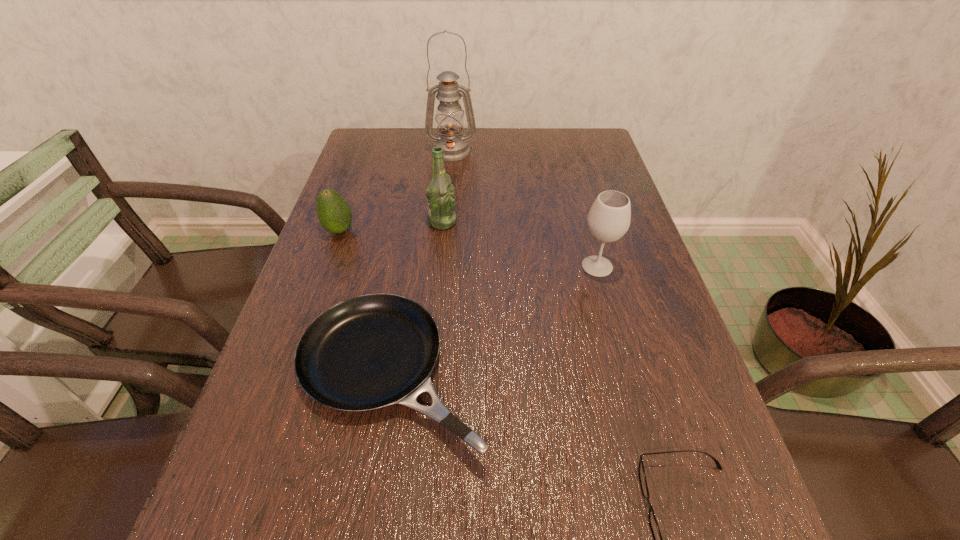
Where is `blank space located on the back of the second shortest object`? blank space located on the back of the second shortest object is located at coordinates (417, 224).

What are the coordinates of `object that is at the far edge` in the screenshot? It's located at (449, 117).

Locate an element on the screen. avocado that is at the left edge is located at coordinates (334, 214).

You are a GUI agent. You are given a task and a screenshot of the screen. Output one action in this format:
    pyautogui.click(x=<x>, y=<y>)
    Task: Click on the pan at the left edge
    The height and width of the screenshot is (540, 960).
    Given the screenshot: What is the action you would take?
    pyautogui.click(x=368, y=352)

I want to click on object present at the right edge, so click(609, 218).

Locate an element on the screen. Image resolution: width=960 pixels, height=540 pixels. vacant space at the far edge of the desktop is located at coordinates (532, 140).

Identify the location of vacant region at the left edge. The width and height of the screenshot is (960, 540). (295, 440).

In the image, there is a desktop. Find the location of `vacant region at the right edge`. vacant region at the right edge is located at coordinates (637, 313).

At what (x,y) coordinates should I click in order to perform the action: click on vacant region at the far right corner. Please return your answer as a coordinate pair (x, y). The width and height of the screenshot is (960, 540). Looking at the image, I should click on (596, 131).

This screenshot has height=540, width=960. In order to click on unoccupied area between the beer bottle and the wineglass in this screenshot , I will do `click(519, 244)`.